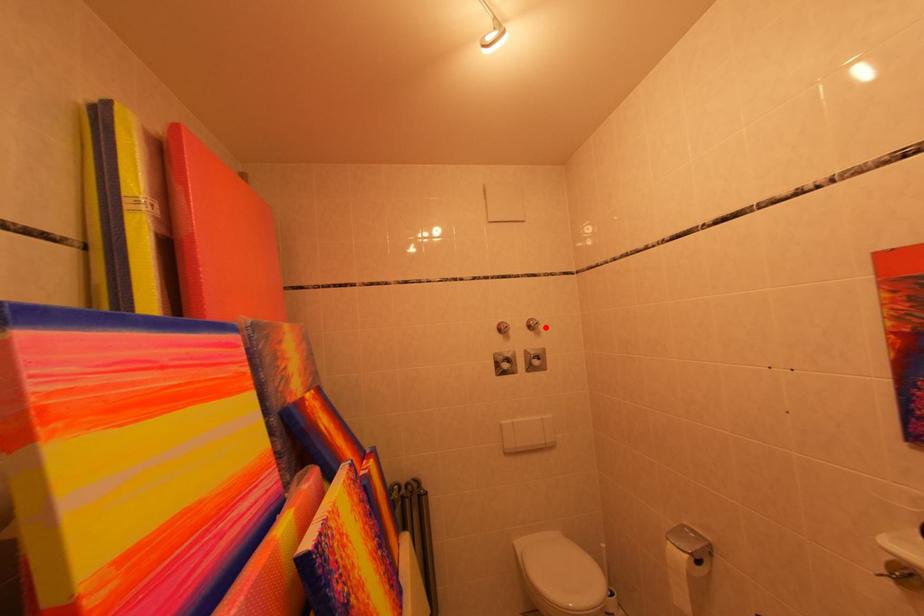
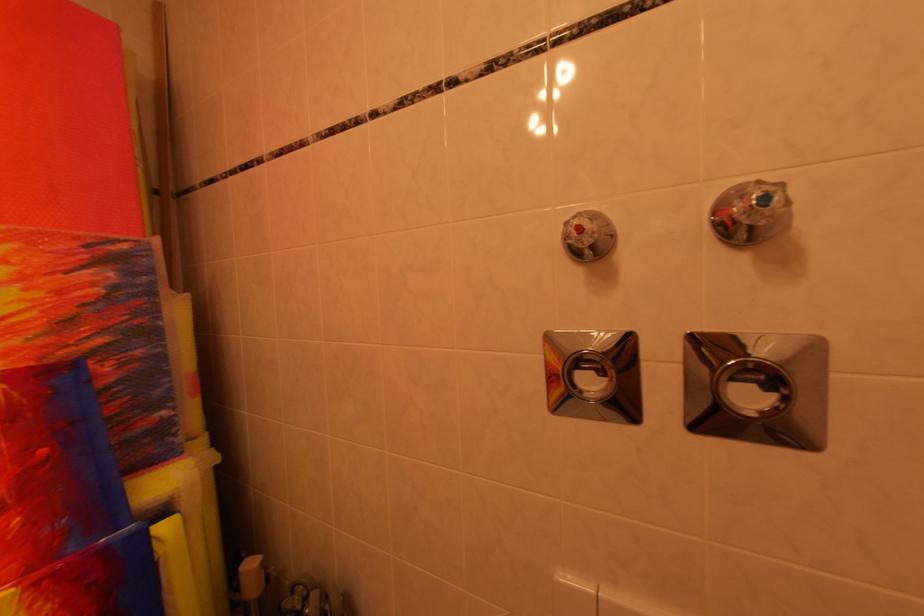
The point at the highlighted location is marked in the first image. Where is the corresponding point in the second image?

(773, 201)